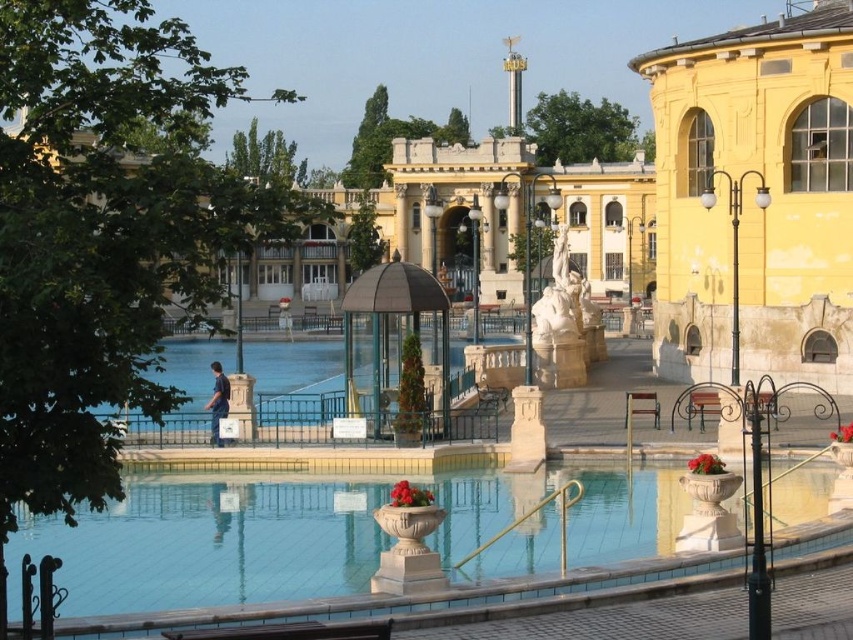
Can you confirm if smooth concrete pool at center is positioned above clear glass water at center?

Incorrect, smooth concrete pool at center is not positioned above clear glass water at center.

Who is positioned more to the left, smooth concrete pool at center or clear glass water at center?

From the viewer's perspective, clear glass water at center appears more on the left side.

Between point (48, 529) and point (299, 365), which one is positioned behind?

The point (299, 365) is more distant.

Find the location of a particular element. smooth concrete pool at center is located at coordinates (335, 554).

Can you confirm if clear glass water at center is positioned to the right of brown wooden bench at center?

In fact, clear glass water at center is to the left of brown wooden bench at center.

Can you confirm if clear glass water at center is positioned above brown wooden bench at center?

Yes, clear glass water at center is above brown wooden bench at center.

The width and height of the screenshot is (853, 640). In order to click on clear glass water at center in this screenshot , I will do `click(253, 365)`.

Can you confirm if smooth concrete pool at center is shorter than yellow painted stone building at right?

Yes.

Is the position of smooth concrete pool at center more distant than that of yellow painted stone building at right?

No, it is not.

Image resolution: width=853 pixels, height=640 pixels. I want to click on smooth concrete pool at center, so click(x=335, y=554).

Where is `smooth concrete pool at center`? The width and height of the screenshot is (853, 640). smooth concrete pool at center is located at coordinates (335, 554).